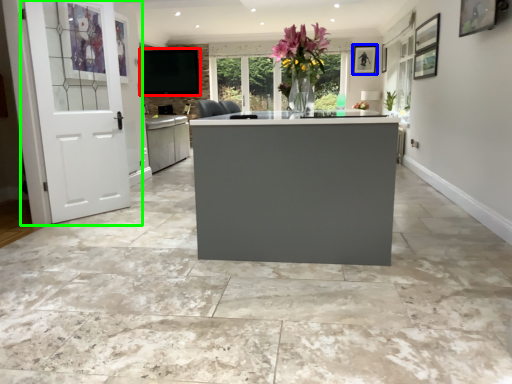
Question: Which is farther away from window screen (highlighted by a red box)? picture frame (highlighted by a blue box) or door (highlighted by a green box)?

Choices:
 (A) picture frame
 (B) door

Answer: (A)